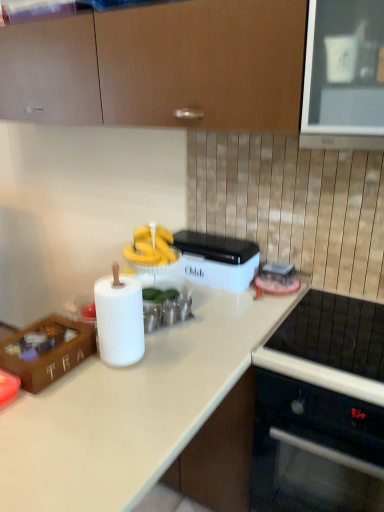
Find the location of a particular element. The image size is (384, 512). free space above white matte countertop at center (from a real-world perspective) is located at coordinates 96,400.